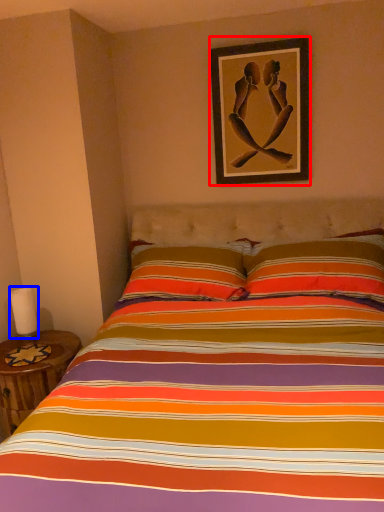
Question: Among these objects, which one is farthest to the camera, picture frame (highlighted by a red box) or candle (highlighted by a blue box)?

Choices:
 (A) picture frame
 (B) candle

Answer: (A)